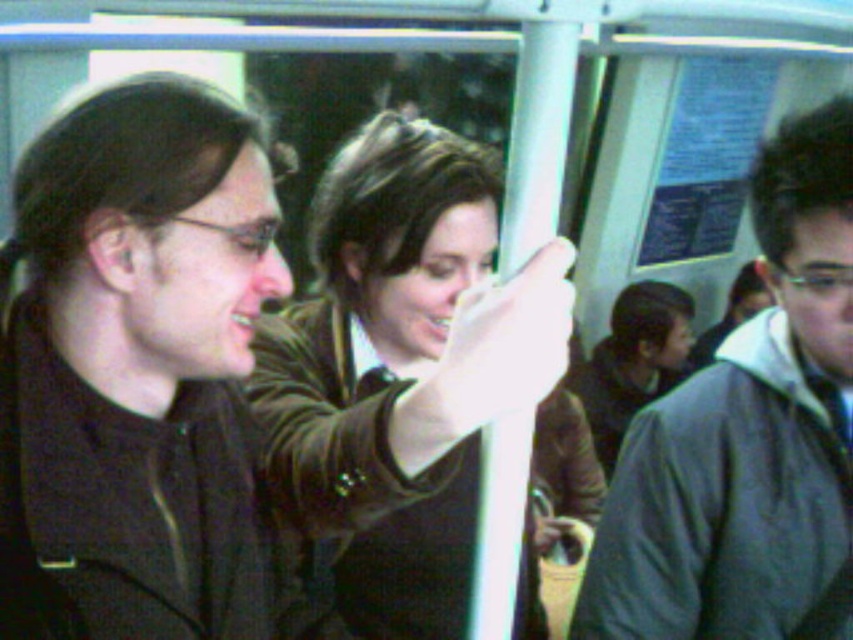
You are a passenger on a subway car and you notice two points marked in the scene. The first point is at coordinate point (497, 369) and the second is at point (810, 148). Which of these two points is closer to you, the observer?

The point at coordinate point (497, 369) is closer to you than the point at (810, 148).

You are a passenger on a subway car and you see a dark brown leather jacket at left and a brown leather jacket at center. Which jacket is closer to the front of the subway car?

The dark brown leather jacket at left is closer to the front of the subway car because the brown leather jacket at center is behind it.